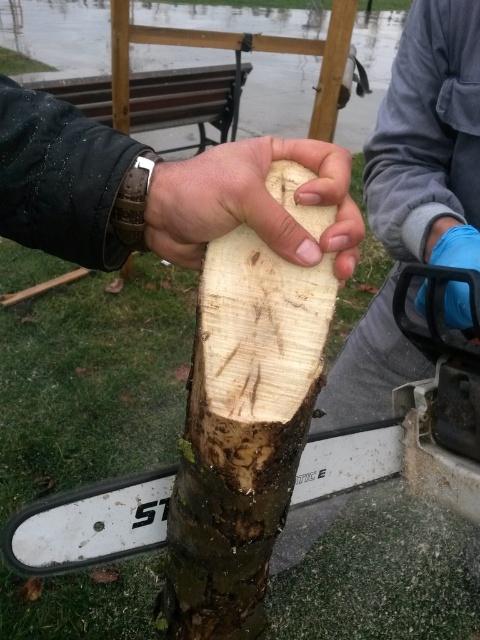
Question: Which point is farther to the camera?

Choices:
 (A) natural wood at center
 (B) wooden plank at center
 (C) light brown wood at center

Answer: (A)

Question: Which point is closer to the camera taking this photo?

Choices:
 (A) (263, 160)
 (B) (88, 200)
 (C) (183, 611)

Answer: (B)

Question: From the image, what is the correct spatial relationship of light brown wood at center in relation to wooden plank at center?

Choices:
 (A) left
 (B) right

Answer: (B)

Question: Does light brown wood at center have a smaller size compared to natural wood at center?

Choices:
 (A) yes
 (B) no

Answer: (A)

Question: Is light brown wood at center positioned at the back of natural wood at center?

Choices:
 (A) yes
 (B) no

Answer: (B)

Question: Which object is the closest to the wooden plank at center?

Choices:
 (A) natural wood at center
 (B) light brown wood at center

Answer: (A)